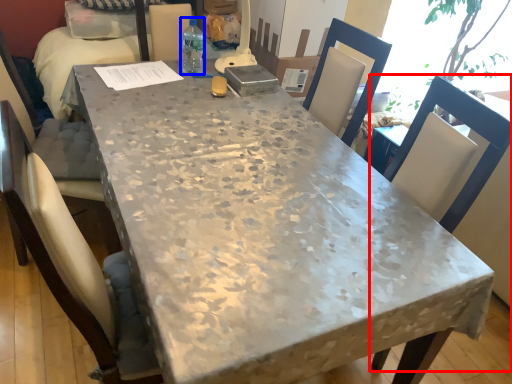
Question: Which object is closer to the camera taking this photo, chair (highlighted by a red box) or bottle (highlighted by a blue box)?

Choices:
 (A) chair
 (B) bottle

Answer: (A)